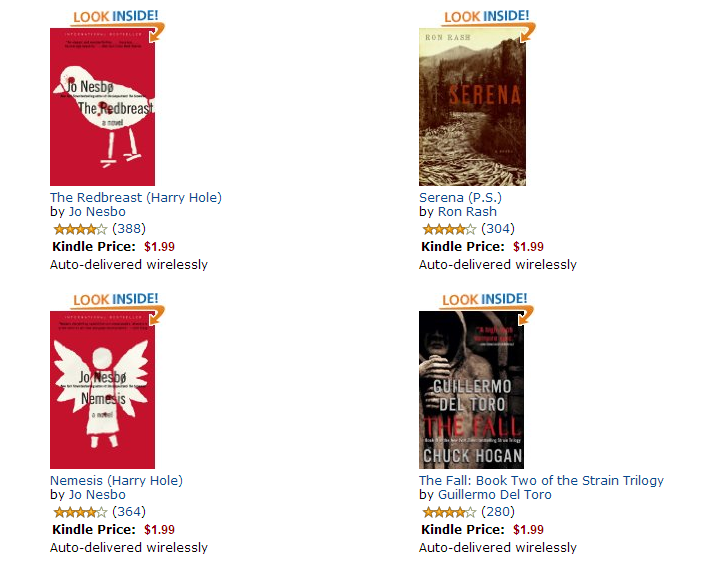
This screenshot has height=563, width=703. I want to click on book covers, so click(117, 122), click(472, 133), click(117, 414), click(463, 409).